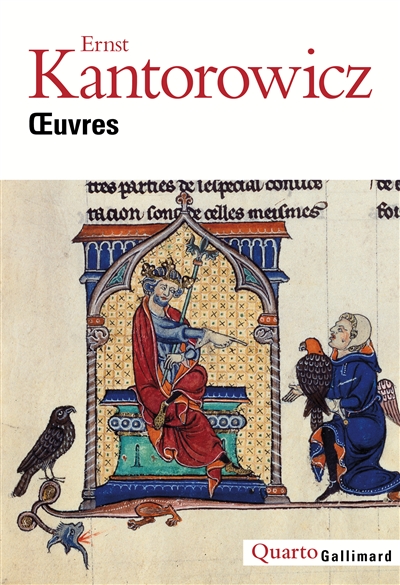
Locate an element on the screen. quarto is located at coordinates (280, 550).